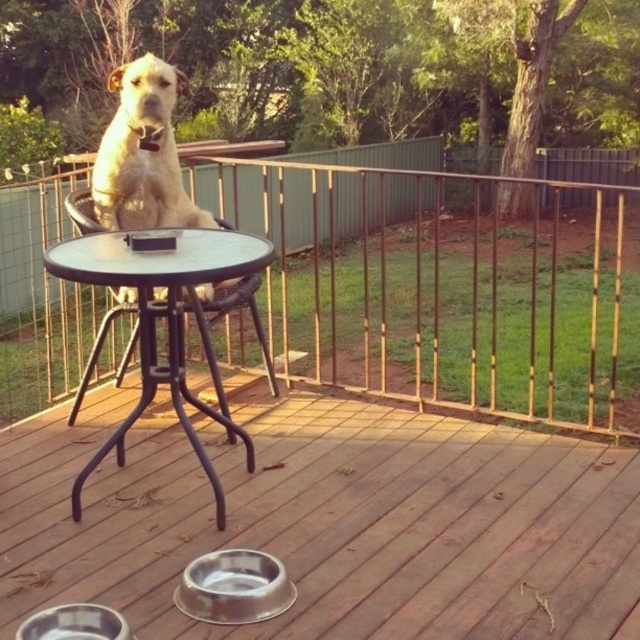
Question: Does metallic silver bowls at lower center appear over black metal table at center?

Choices:
 (A) yes
 (B) no

Answer: (B)

Question: Can you confirm if metallic brown railing at upper center is positioned to the right of white fur dog at center?

Choices:
 (A) yes
 (B) no

Answer: (A)

Question: Which of the following is the farthest from the observer?

Choices:
 (A) metallic silver bowls at lower center
 (B) black metal table at center
 (C) white fur dog at center
 (D) metallic brown railing at upper center

Answer: (C)

Question: Does black metal table at center appear on the left side of white fur dog at center?

Choices:
 (A) no
 (B) yes

Answer: (A)

Question: Which object appears closest to the camera in this image?

Choices:
 (A) metallic brown railing at upper center
 (B) black metal table at center

Answer: (B)

Question: Which object is closer to the camera taking this photo?

Choices:
 (A) white fur dog at center
 (B) metallic brown railing at upper center

Answer: (B)